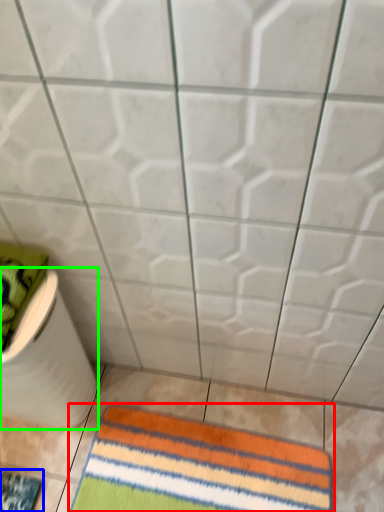
Question: Based on their relative distances, which object is farther from towel (highlighted by a red box)? Choose from mat (highlighted by a blue box) and toilet paper (highlighted by a green box).

Choices:
 (A) mat
 (B) toilet paper

Answer: (A)